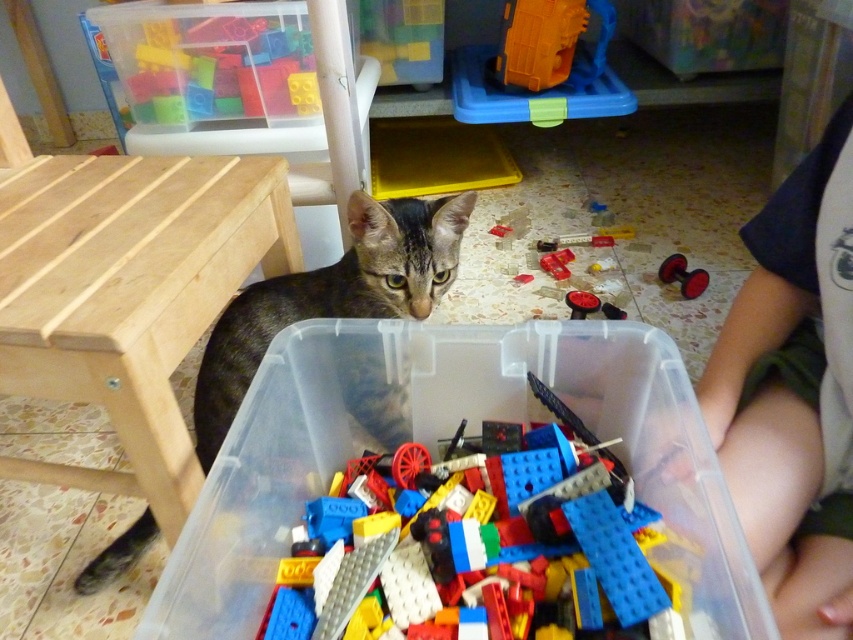
Is point (142, 244) positioned behind point (561, 253)?

No.

This screenshot has width=853, height=640. Describe the element at coordinates (129, 296) in the screenshot. I see `bare wood stool at left` at that location.

Locate an element on the screen. The width and height of the screenshot is (853, 640). bare wood stool at left is located at coordinates (129, 296).

Is the position of translucent plastic container at lower center more distant than that of bare wood stool at left?

No, translucent plastic container at lower center is in front of bare wood stool at left.

Between point (674, 531) and point (122, 211), which one is positioned in front?

Positioned in front is point (674, 531).

Locate an element on the screen. The image size is (853, 640). translucent plastic container at lower center is located at coordinates tap(436, 458).

Image resolution: width=853 pixels, height=640 pixels. What do you see at coordinates (538, 42) in the screenshot?
I see `orange plastic toy at upper center` at bounding box center [538, 42].

From the picture: Who is taller, orange plastic toy at upper center or rubberized red bricks at center?

orange plastic toy at upper center is taller.

Is point (508, 72) less distant than point (555, 252)?

No.

Where is `orange plastic toy at upper center`? This screenshot has width=853, height=640. orange plastic toy at upper center is located at coordinates (538, 42).